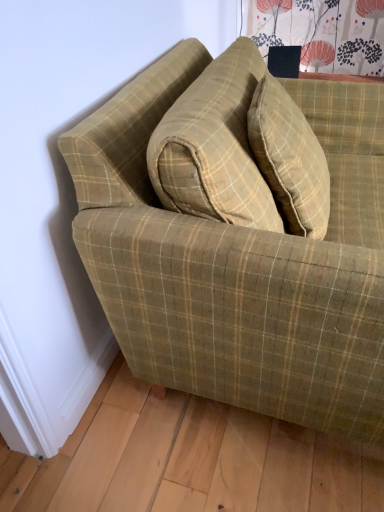
What are the coordinates of `green plaid fabric couch at center` in the screenshot? It's located at (222, 281).

The height and width of the screenshot is (512, 384). What do you see at coordinates (222, 281) in the screenshot?
I see `green plaid fabric couch at center` at bounding box center [222, 281].

This screenshot has width=384, height=512. Find the location of `green plaid fabric couch at center`. green plaid fabric couch at center is located at coordinates click(222, 281).